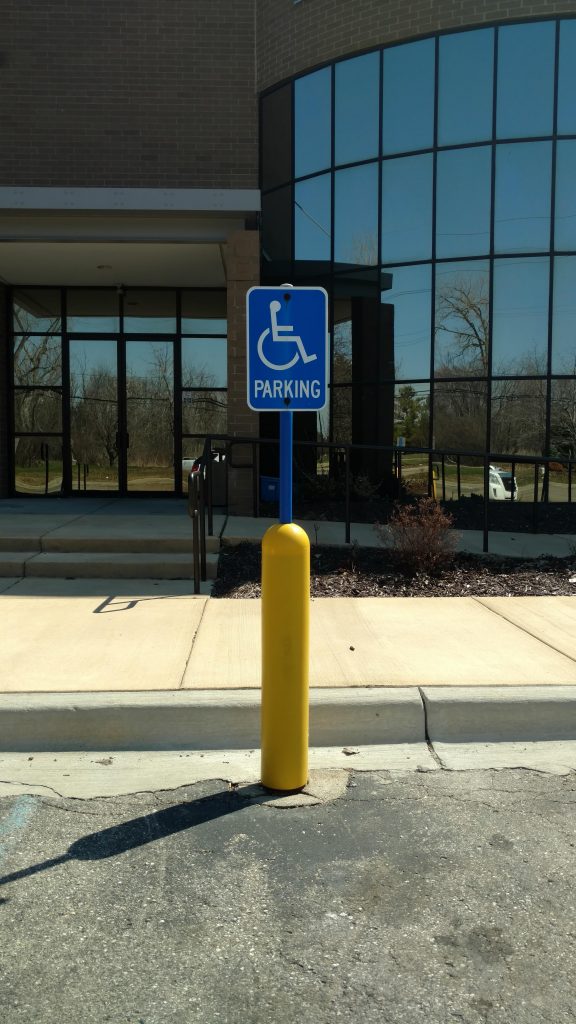
Locate an element on the screen. large windows on right is located at coordinates (319, 422), (348, 345), (415, 325), (406, 423), (473, 435), (473, 340), (530, 343), (528, 429), (564, 433), (566, 337).